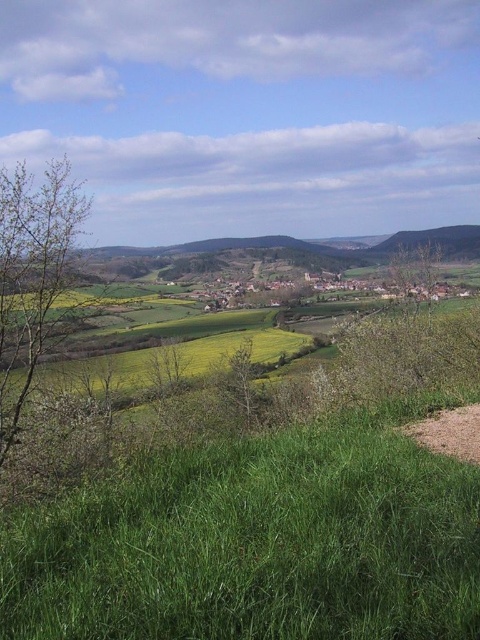
You are standing at the viewpoint overlooking the rural landscape. You notice two points marked on the dirt path. Which point is closer to you, point (x=462, y=637) or point (x=455, y=448)?

Point (x=462, y=637) is closer to the viewer than point (x=455, y=448).

You are standing at the origin point of the image coordinate system. The origin is at the bottom left corner of the image. You need to walk towards the green grassy at lower right. In which direction should you move first?

Since the green grassy at lower right is located at coordinate point 0.852 on the x axis and 0.531 on the y axis, you should first move to the right along the x axis direction to reach it.